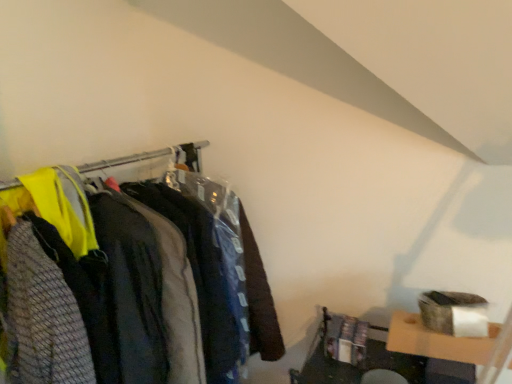
Question: In terms of height, does matte black clothing at left look taller or shorter compared to textured gray sweater at left, which is counted as the first clothing, starting from the front?

Choices:
 (A) short
 (B) tall

Answer: (B)

Question: Relative to textured gray sweater at left, which is counted as the first clothing, starting from the front, is matte black clothing at left in front or behind?

Choices:
 (A) behind
 (B) front

Answer: (A)

Question: Which is farther from the dark gray fabric jacket at center, the second clothing in the front-to-back sequence?

Choices:
 (A) textured gray sweater at left, the second clothing from the back
 (B) matte black clothing at left

Answer: (B)

Question: Based on their relative distances, which object is farther from the matte black clothing at left?

Choices:
 (A) dark gray fabric jacket at center, which appears as the 1th clothing when viewed from the back
 (B) textured gray sweater at left, which is counted as the first clothing, starting from the front

Answer: (B)